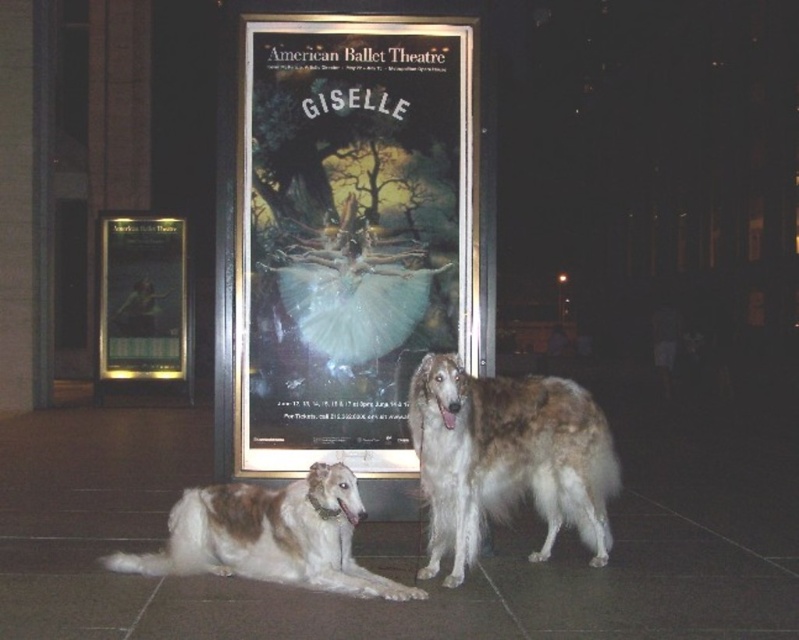
Does gold-framed poster at center have a greater width compared to brown and white fur at lower left?

No.

This screenshot has height=640, width=799. I want to click on gold-framed poster at center, so click(x=348, y=234).

How far apart are white fluffy tutu at center and matte glass poster at center?

white fluffy tutu at center and matte glass poster at center are 32.12 feet apart from each other.

Is white fluffy tutu at center thinner than matte glass poster at center?

Yes.

Who is more forward, (x=411, y=232) or (x=110, y=260)?

Point (x=411, y=232) is more forward.

This screenshot has width=799, height=640. I want to click on white fluffy tutu at center, so click(356, 289).

Can you confirm if gold-framed poster at center is positioned to the right of white fluffy tutu at center?

In fact, gold-framed poster at center is to the left of white fluffy tutu at center.

Is gold-framed poster at center wider than white fluffy tutu at center?

Correct, the width of gold-framed poster at center exceeds that of white fluffy tutu at center.

Measure the distance between gold-framed poster at center and camera.

gold-framed poster at center and camera are 18.21 feet apart.

I want to click on gold-framed poster at center, so click(348, 234).